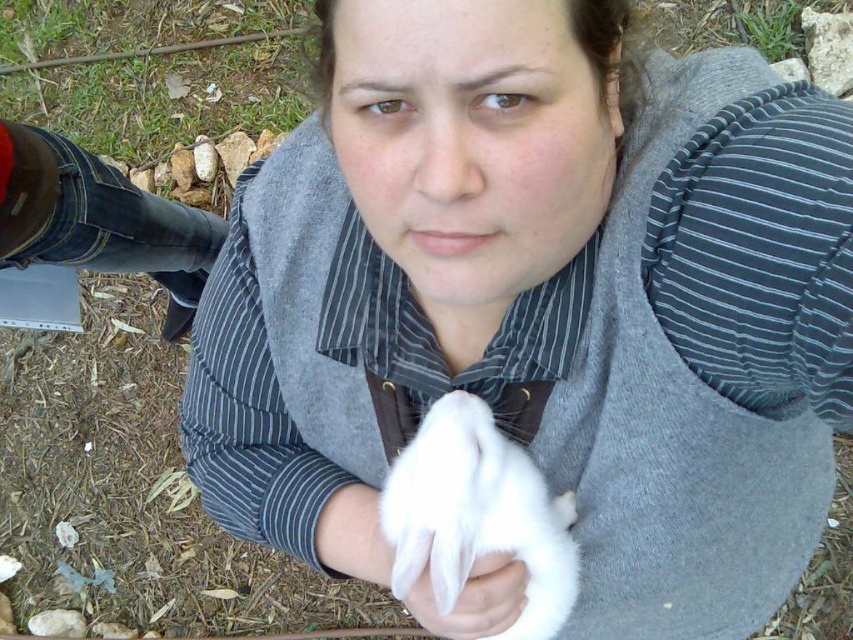
Question: Which object appears closest to the camera in this image?

Choices:
 (A) white soft cloth at center
 (B) white soft fur at center

Answer: (B)

Question: Which point is farther from the camera taking this photo?

Choices:
 (A) (485, 536)
 (B) (483, 632)

Answer: (B)

Question: Can you confirm if white soft fur at center is thinner than white soft cloth at center?

Choices:
 (A) yes
 (B) no

Answer: (B)

Question: Can you confirm if white soft fur at center is thinner than white soft cloth at center?

Choices:
 (A) yes
 (B) no

Answer: (B)

Question: Is white soft fur at center thinner than white soft cloth at center?

Choices:
 (A) no
 (B) yes

Answer: (A)